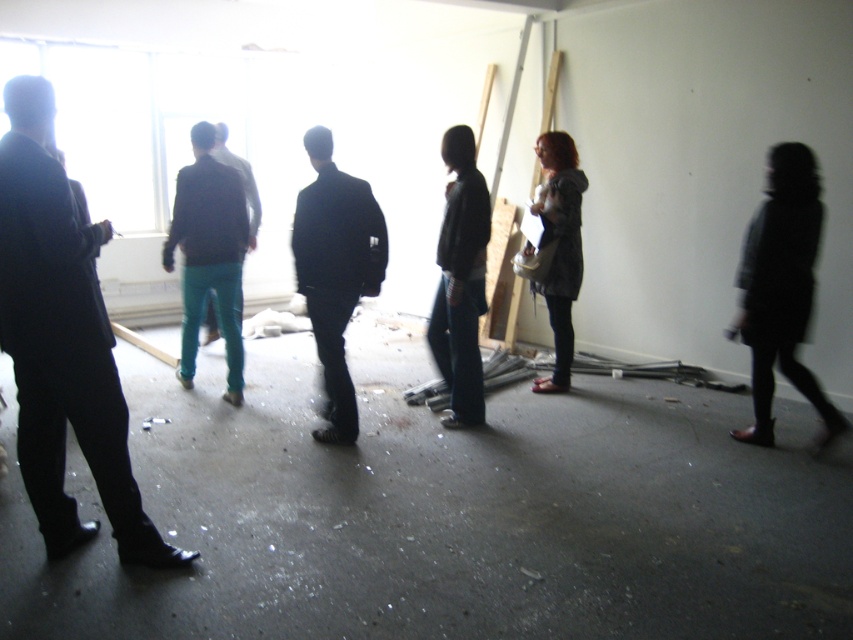
Between dark gray fabric dress at right and matte gray jacket at center, which one has less height?

With less height is dark gray fabric dress at right.

Can you confirm if dark gray fabric dress at right is thinner than matte gray jacket at center?

No, dark gray fabric dress at right is not thinner than matte gray jacket at center.

What do you see at coordinates (781, 289) in the screenshot?
I see `dark gray fabric dress at right` at bounding box center [781, 289].

Where is `dark gray fabric dress at right`? dark gray fabric dress at right is located at coordinates (781, 289).

Does dark gray jacket at center appear on the left side of matte gray jacket at center?

Indeed, dark gray jacket at center is positioned on the left side of matte gray jacket at center.

Is dark gray jacket at center positioned behind matte gray jacket at center?

No, dark gray jacket at center is closer to the viewer.

This screenshot has height=640, width=853. What are the coordinates of `dark gray jacket at center` in the screenshot? It's located at (460, 280).

Which is below, black matte suit at center or matte gray jacket at center?

black matte suit at center is below.

Is point (300, 196) farther from viewer compared to point (556, 136)?

That is False.

At what (x,y) coordinates should I click in order to perform the action: click on black matte suit at center. Please return your answer as a coordinate pair (x, y). The height and width of the screenshot is (640, 853). Looking at the image, I should click on (335, 272).

Identify the location of black matte suit at center. Image resolution: width=853 pixels, height=640 pixels. (335, 272).